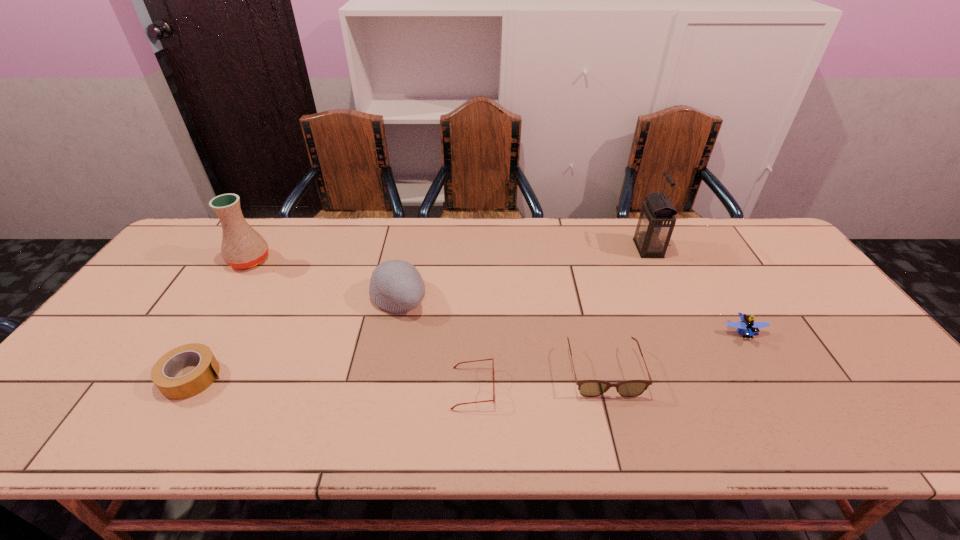
Locate an element on the screen. lantern present at the far edge is located at coordinates (657, 219).

Find the location of a particular element. The image size is (960, 540). pottery that is at the far edge is located at coordinates (242, 247).

Find the location of a particular element. The height and width of the screenshot is (540, 960). object that is positioned at the near edge is located at coordinates (493, 400).

Locate an element on the screen. This screenshot has height=540, width=960. vacant space at the far edge of the desktop is located at coordinates (281, 257).

The height and width of the screenshot is (540, 960). What are the coordinates of `free region at the near edge` in the screenshot? It's located at coord(182,409).

Where is `free space at the left edge of the desktop`? The image size is (960, 540). free space at the left edge of the desktop is located at coordinates (145, 288).

Identify the location of vacant region at the far right corner. The width and height of the screenshot is (960, 540). (763, 240).

This screenshot has height=540, width=960. I want to click on free space between the duct tape and the left spectacles, so (333, 382).

You are a GUI agent. You are given a task and a screenshot of the screen. Output one action in this format:
    pyautogui.click(x=<x>, y=<y>)
    Task: Click on the vacant point located between the Lego and the beanie
    
    Given the screenshot: What is the action you would take?
    pyautogui.click(x=570, y=315)

What are the coordinates of `blank region between the third object from right to left and the pottery` in the screenshot? It's located at (426, 315).